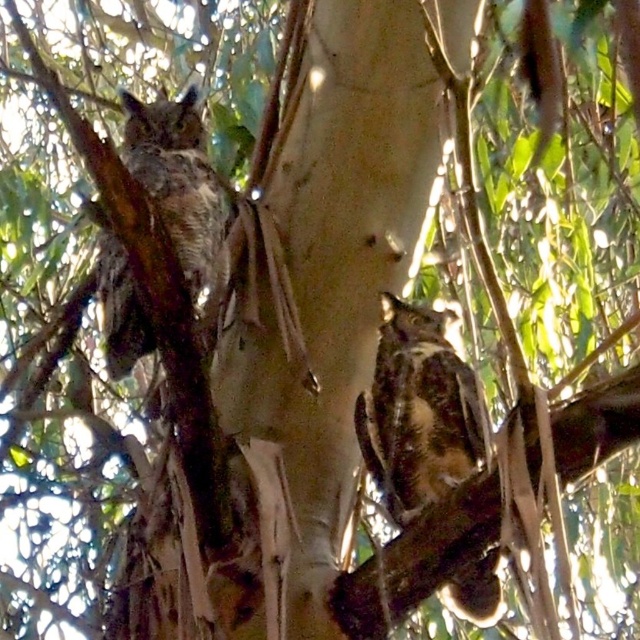
You are a birdwatcher observing two brown speckled owls in a tree. You see the brown speckled owl at center and the brown speckled owl at left. Which owl is located below the other?

The brown speckled owl at center is positioned under the brown speckled owl at left.

You are a birdwatcher trying to observe the two brown speckled owls in the scene. Which owl is closer to you, the brown speckled owl at center or the brown speckled owl at left?

The brown speckled owl at center is closer to you because it is further to the viewer than the brown speckled owl at left.